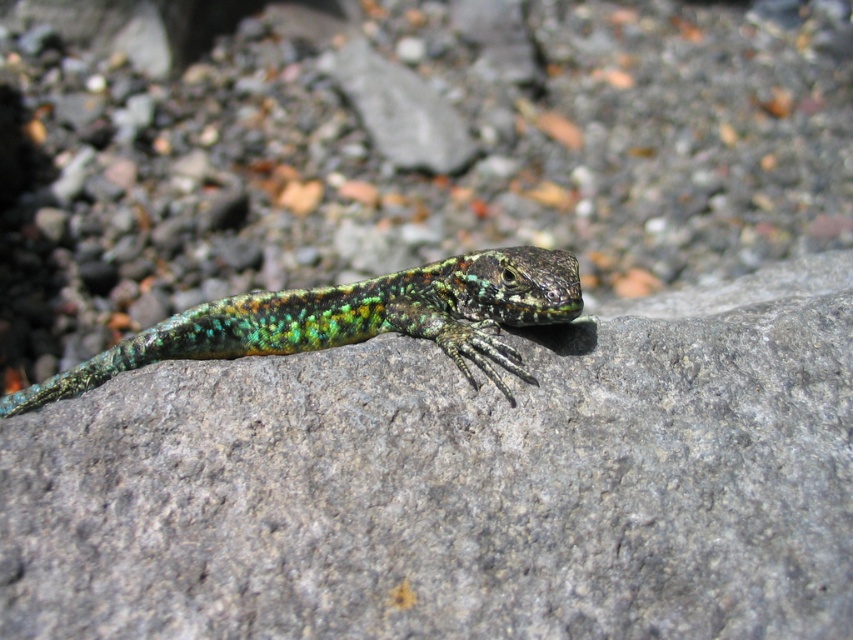
Is green speckled rock at center to the right of shiny green lizard at center from the viewer's perspective?

Yes, green speckled rock at center is to the right of shiny green lizard at center.

Can you confirm if green speckled rock at center is positioned below shiny green lizard at center?

Correct, green speckled rock at center is located below shiny green lizard at center.

Between point (798, 380) and point (494, 282), which one is positioned in front?

Point (798, 380) is more forward.

Identify the location of green speckled rock at center. This screenshot has width=853, height=640. (459, 483).